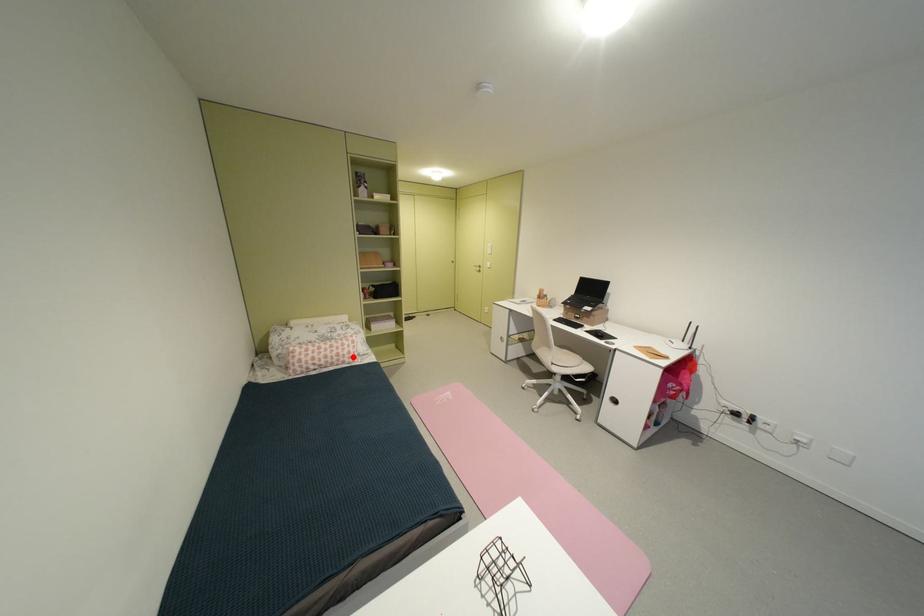
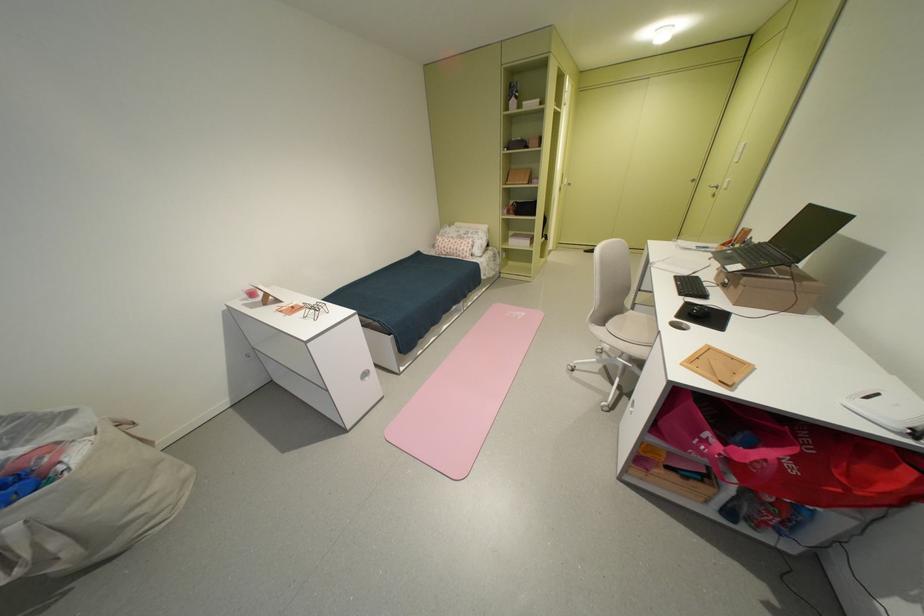
In the second image, find the point that corresponds to the highlighted location in the first image.

(468, 252)